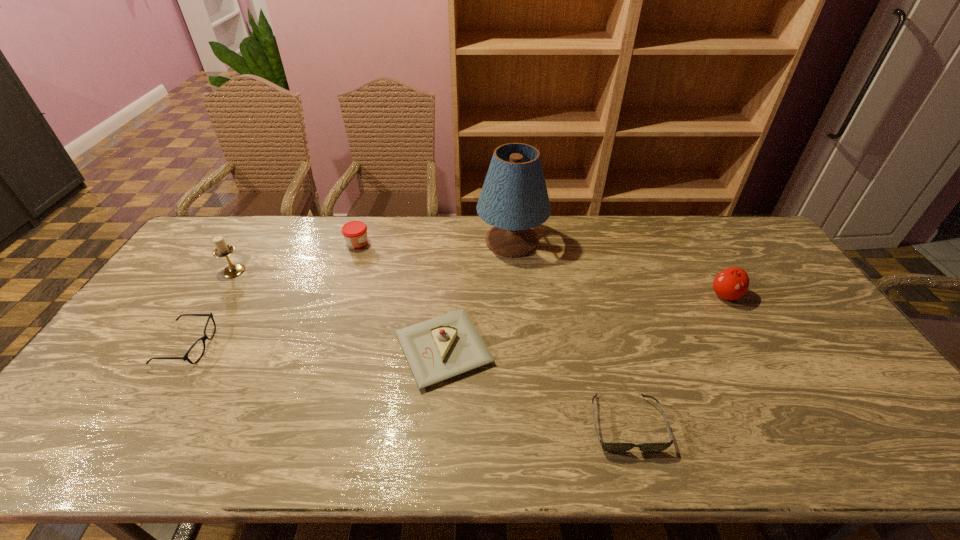
Find the location of a particular element. The image size is (960, 540). free location that satisfies the following two spatial constraints: 1. on the label side of the fifth object from right to left; 2. on the back side of the cake is located at coordinates (323, 349).

Where is `free space that satisfies the following two spatial constraints: 1. on the label side of the cake; 2. on the left side of the fifth object from right to left`? The height and width of the screenshot is (540, 960). free space that satisfies the following two spatial constraints: 1. on the label side of the cake; 2. on the left side of the fifth object from right to left is located at coordinates [323, 349].